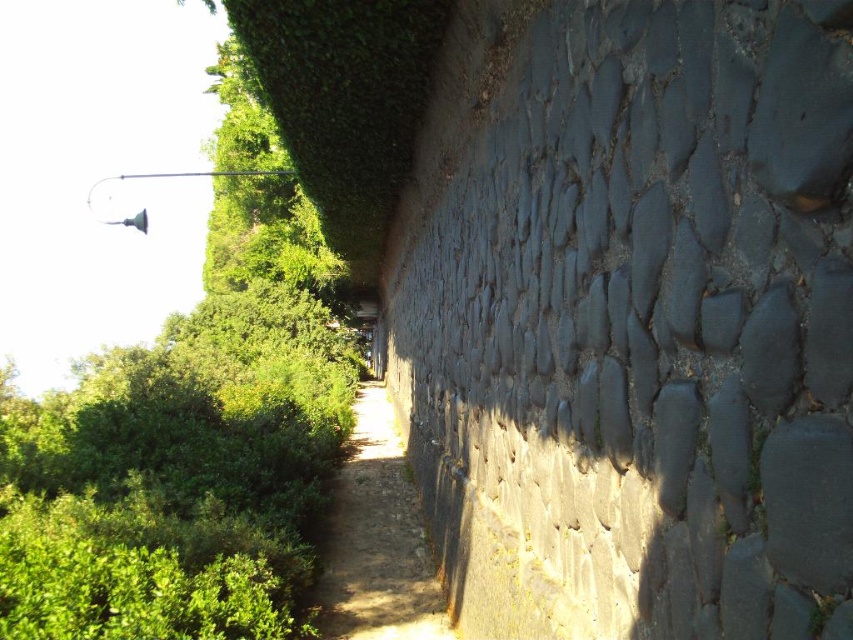
Which is more to the left, dark gray stone wall at right or dirt path at center?

Positioned to the left is dirt path at center.

Can you confirm if dark gray stone wall at right is taller than dirt path at center?

Yes, dark gray stone wall at right is taller than dirt path at center.

Is point (728, 500) in front of point (335, 476)?

Yes, point (728, 500) is closer to viewer.

Find the location of a particular element. Image resolution: width=853 pixels, height=640 pixels. dark gray stone wall at right is located at coordinates (634, 317).

Which is more to the left, dark gray stone wall at right or green leafy tree at upper left?

From the viewer's perspective, green leafy tree at upper left appears more on the left side.

Does point (450, 552) come in front of point (238, 586)?

No, (450, 552) is further to viewer.

I want to click on dark gray stone wall at right, so click(x=634, y=317).

Who is more forward, (169, 385) or (363, 476)?

Point (169, 385)

How much distance is there between green leafy tree at upper left and dirt path at center?

The distance of green leafy tree at upper left from dirt path at center is 6.54 meters.

Who is more distant from viewer, (165, 509) or (358, 435)?

The point (358, 435) is behind.

Find the location of `green leafy tree at upper left`. green leafy tree at upper left is located at coordinates (190, 432).